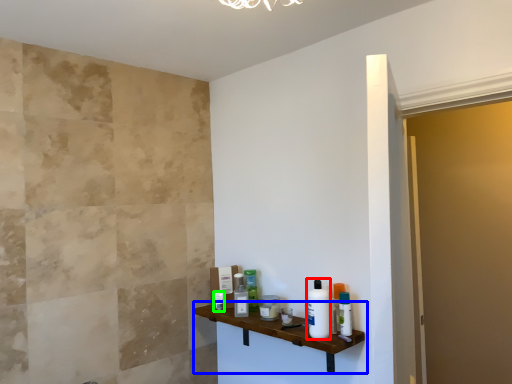
Question: Which object is positioned farthest from toiletry (highlighted by a red box)? Select from shelf (highlighted by a blue box) and toiletry (highlighted by a green box).

Choices:
 (A) shelf
 (B) toiletry

Answer: (B)